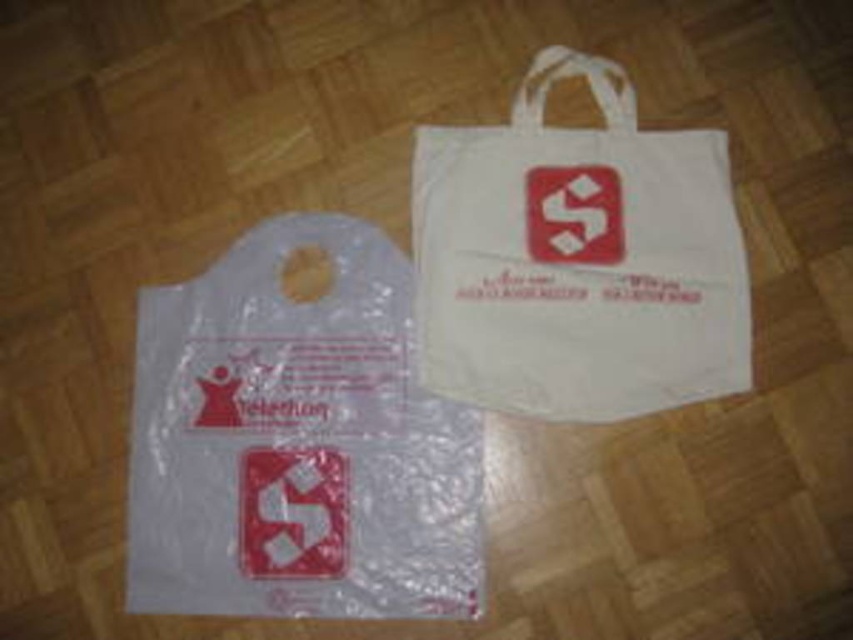
Question: Is transparent plastic bag at lower left thinner than white fabric bag at upper right?

Choices:
 (A) no
 (B) yes

Answer: (A)

Question: Which point appears closest to the camera in this image?

Choices:
 (A) (235, 611)
 (B) (711, 332)

Answer: (A)

Question: Can you confirm if transparent plastic bag at lower left is positioned above white fabric bag at upper right?

Choices:
 (A) no
 (B) yes

Answer: (A)

Question: Can you confirm if transparent plastic bag at lower left is positioned to the right of white fabric bag at upper right?

Choices:
 (A) yes
 (B) no

Answer: (B)